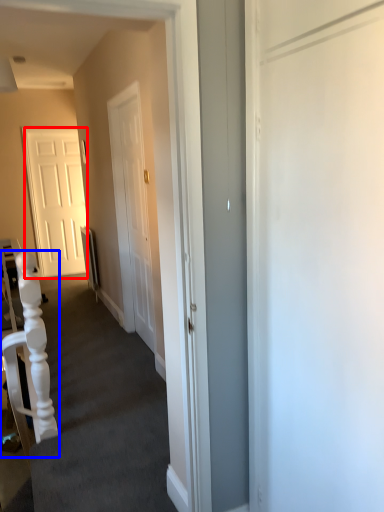
Question: Which object is closer to the camera taking this photo, door (highlighted by a red box) or armchair (highlighted by a blue box)?

Choices:
 (A) door
 (B) armchair

Answer: (B)